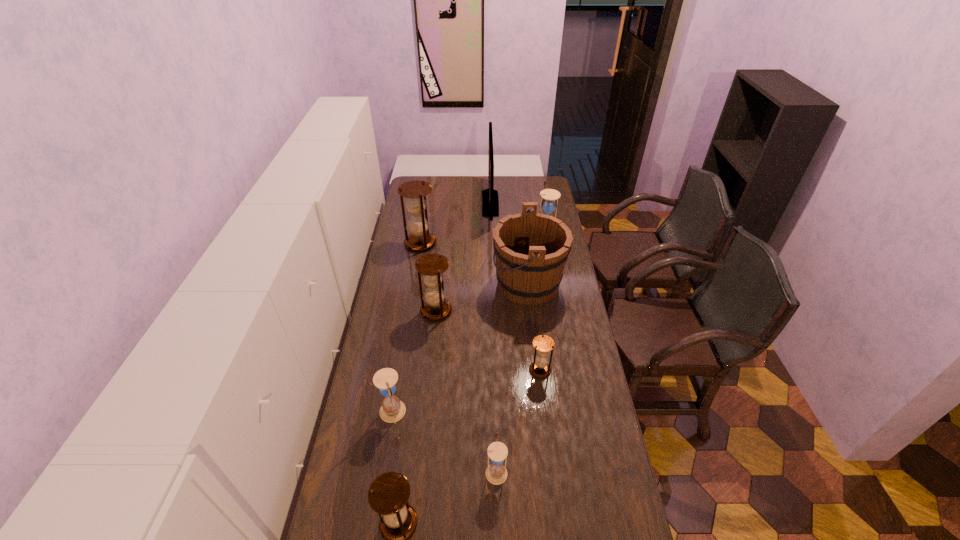
Identify the location of the second nearest object. The width and height of the screenshot is (960, 540). pyautogui.click(x=496, y=473).

What are the coordinates of `the second white hourglass from left to right` in the screenshot? It's located at (496, 473).

Find the location of `the smallest brown hourglass`. the smallest brown hourglass is located at coordinates (543, 344).

Image resolution: width=960 pixels, height=540 pixels. Identify the location of the sixth hourglass from left to right. (543, 344).

You are a GUI agent. You are given a task and a screenshot of the screen. Output one action in this format:
    pyautogui.click(x=<x>, y=<y>)
    Task: Click on the vacant space situated on the front-facing side of the monitor
    This screenshot has height=540, width=960.
    Given the screenshot: What is the action you would take?
    pyautogui.click(x=419, y=203)

Find the location of `free space located on the front-facing side of the monitor`. free space located on the front-facing side of the monitor is located at coordinates (444, 203).

Identify the location of vacant area located 0.310m on the front-facing side of the monitor. The height and width of the screenshot is (540, 960). (427, 203).

This screenshot has height=540, width=960. I want to click on vacant space located on the side of the wine bucket with the handle for carrying, so click(x=455, y=284).

This screenshot has height=540, width=960. I want to click on vacant space situated on the side of the wine bucket with the handle for carrying, so click(448, 284).

This screenshot has height=540, width=960. Identify the location of vacant space located 0.200m on the side of the wine bucket with the handle for carrying. (448, 284).